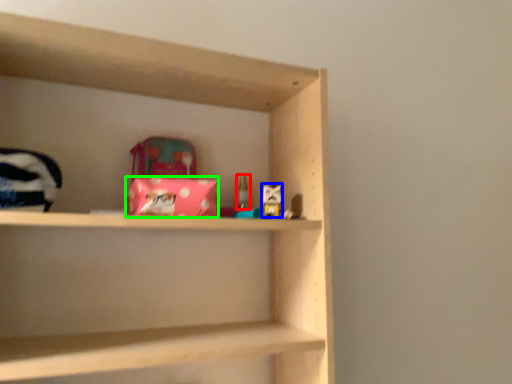
Question: Which object is the farthest from toy (highlighted by a red box)? Choose among these: toy (highlighted by a blue box) or material (highlighted by a green box).

Choices:
 (A) toy
 (B) material

Answer: (B)